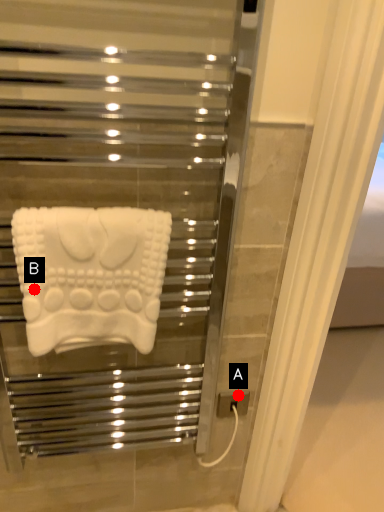
Question: Two points are circled on the image, labeled by A and B beside each circle. Which point is closer to the camera?

Choices:
 (A) A is closer
 (B) B is closer

Answer: (B)